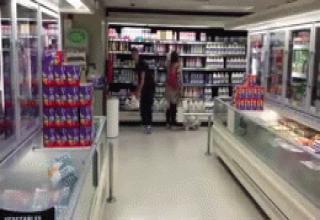
The height and width of the screenshot is (220, 320). I want to click on boxes pile on counter, so click(x=75, y=127), click(x=253, y=97).